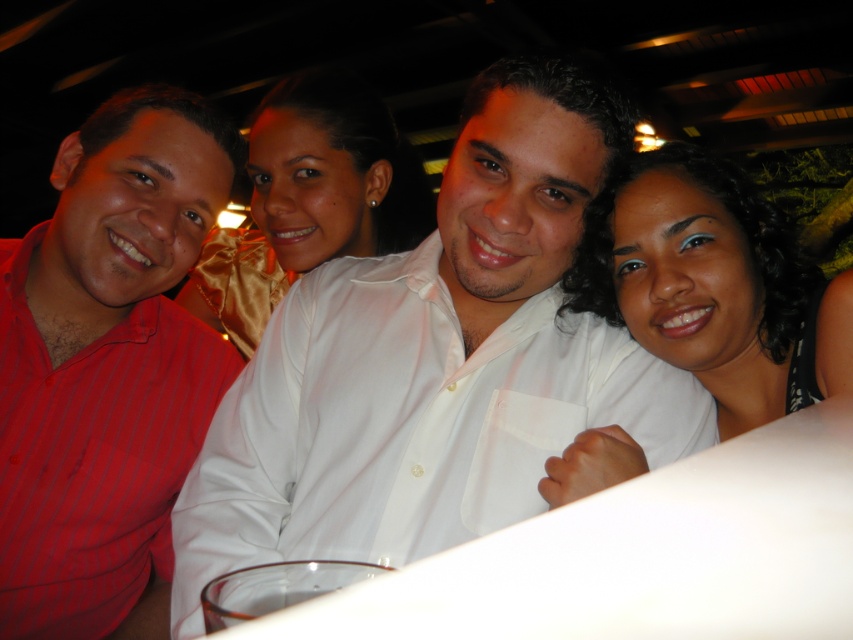
Can you confirm if satin black dress at center is shorter than white satin blouse at center?

Yes, satin black dress at center is shorter than white satin blouse at center.

This screenshot has width=853, height=640. Identify the location of satin black dress at center. (714, 285).

Is point (328, 513) in front of point (845, 333)?

Yes.

Does point (329, 500) come in front of point (840, 358)?

No, (329, 500) is behind (840, 358).

You are a GUI agent. You are given a task and a screenshot of the screen. Output one action in this format:
    pyautogui.click(x=<x>, y=<y>)
    Task: Click on the white satin shirt at center
    
    Given the screenshot: What is the action you would take?
    pyautogui.click(x=405, y=422)

In the scene shown: Between red striped shirt at left and white satin blouse at center, which one appears on the right side from the viewer's perspective?

From the viewer's perspective, white satin blouse at center appears more on the right side.

Locate an element on the screen. Image resolution: width=853 pixels, height=640 pixels. red striped shirt at left is located at coordinates (106, 362).

At what (x,y) coordinates should I click in order to perform the action: click on red striped shirt at left. Please return your answer as a coordinate pair (x, y). The width and height of the screenshot is (853, 640). Looking at the image, I should click on (106, 362).